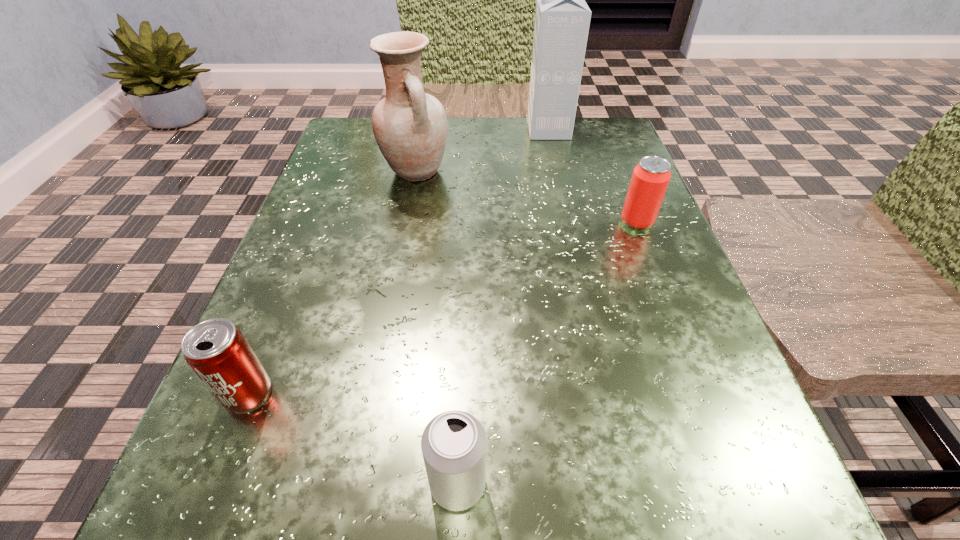
Find the location of a particular element. This screenshot has width=960, height=540. free spot at the far left corner of the desktop is located at coordinates (356, 137).

The height and width of the screenshot is (540, 960). I want to click on free space at the near left corner of the desktop, so click(172, 531).

Where is `free space at the far right corner`? Image resolution: width=960 pixels, height=540 pixels. free space at the far right corner is located at coordinates (618, 147).

Locate an element on the screen. Image resolution: width=960 pixels, height=540 pixels. free spot at the near right corner of the desktop is located at coordinates (750, 525).

Image resolution: width=960 pixels, height=540 pixels. Find the location of `blank region between the carton and the rightmost beer can`. blank region between the carton and the rightmost beer can is located at coordinates (592, 176).

Identify the location of vacant area that lies between the second object from left to right and the farthest beer can. This screenshot has height=540, width=960. (526, 197).

Locate an element on the screen. The width and height of the screenshot is (960, 540). blank region between the second tallest object and the nearest object is located at coordinates (437, 328).

You are a GUI agent. You are given a task and a screenshot of the screen. Output one action in this format:
    pyautogui.click(x=<x>, y=<y>)
    Task: Click on the empty location between the nearest beer can and the leftmost beer can
    This screenshot has height=540, width=960.
    Given the screenshot: What is the action you would take?
    pyautogui.click(x=353, y=438)

You are a GUI agent. You are given a task and a screenshot of the screen. Output one action in this format:
    pyautogui.click(x=<x>, y=<y>)
    Task: Click on the free space between the third farthest object and the nearest beer can
    The width and height of the screenshot is (960, 540).
    Given the screenshot: What is the action you would take?
    pyautogui.click(x=547, y=353)

This screenshot has width=960, height=540. What are the coordinates of `empty location between the nearest beer can and the second object from right to left` in the screenshot? It's located at (503, 307).